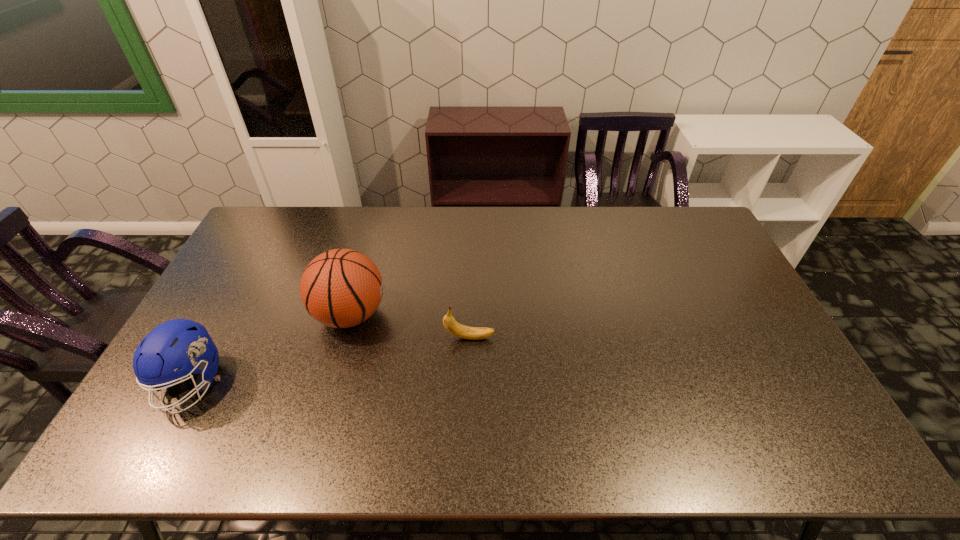
Where is `vacant space that satisfies the following two spatial constraints: 1. at the start of the peel on the shortest object; 2. on the front-facing side of the football helmet`? The height and width of the screenshot is (540, 960). vacant space that satisfies the following two spatial constraints: 1. at the start of the peel on the shortest object; 2. on the front-facing side of the football helmet is located at coordinates (468, 383).

You are a GUI agent. You are given a task and a screenshot of the screen. Output one action in this format:
    pyautogui.click(x=<x>, y=<y>)
    Task: Click on the vacant point that satisfies the following two spatial constraints: 1. on the side where the inflation valve is located; 2. on the front-facing side of the leftmost object
    This screenshot has height=540, width=960.
    Given the screenshot: What is the action you would take?
    pyautogui.click(x=331, y=383)

Identify the location of blank area in the image that satisfies the following two spatial constraints: 1. on the side where the inflation valve is located; 2. on the front-facing side of the second shortest object. (331, 383).

Find the location of a particular element. Image resolution: width=960 pixels, height=540 pixels. vacant position in the image that satisfies the following two spatial constraints: 1. at the start of the peel on the shortest object; 2. on the front-facing side of the nearest object is located at coordinates (468, 383).

The image size is (960, 540). I want to click on free space that satisfies the following two spatial constraints: 1. on the side where the inflation valve is located; 2. on the front-facing side of the leftmost object, so click(x=331, y=383).

Identify the location of free spot that satisfies the following two spatial constraints: 1. at the start of the peel on the banana; 2. on the front-facing side of the football helmet. (468, 383).